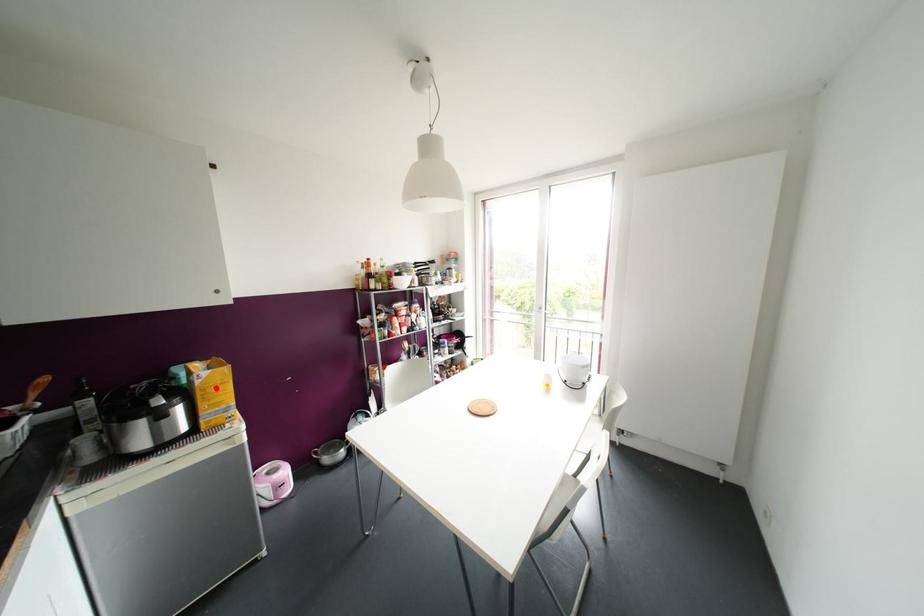
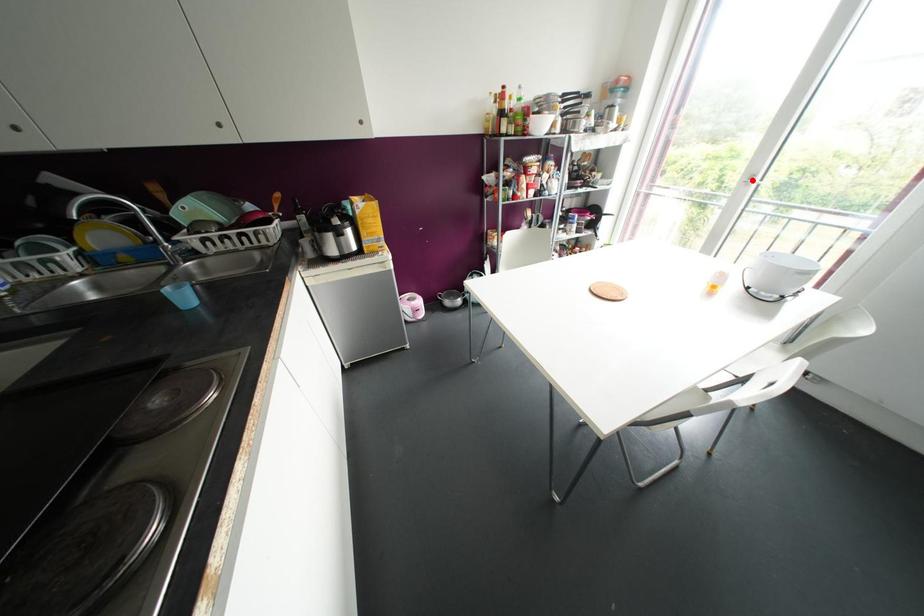
From the picture: I am providing you with two images of the same scene from different viewpoints. A red point is marked on the first image and another point is marked on the second image. Are the points marked in image1 and image2 representing the same 3D position?

No